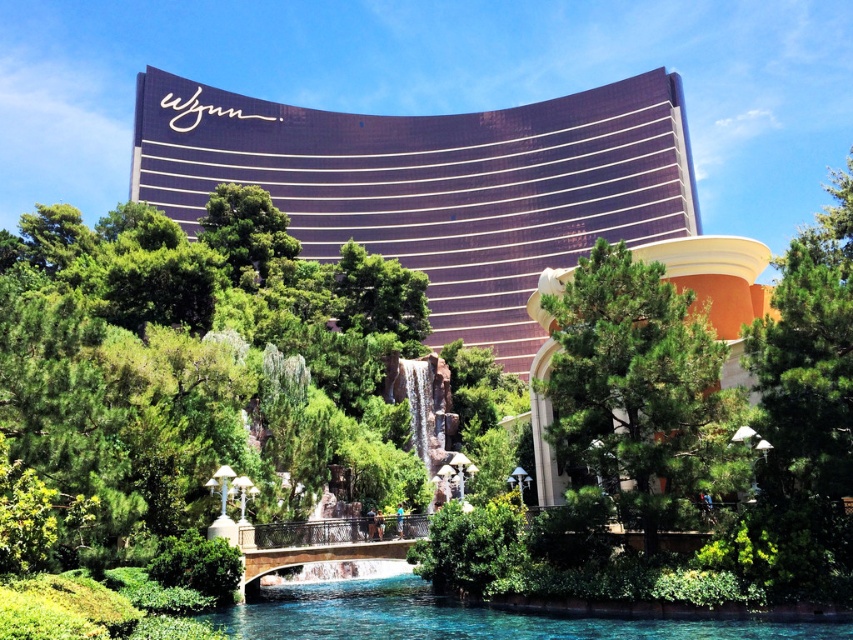
Is metallic gold hotel at upper center further to camera compared to clear blue water at lower center?

Yes, it is.

Who is more forward, (514, 262) or (413, 634)?

Point (413, 634)

This screenshot has width=853, height=640. What are the coordinates of `metallic gold hotel at upper center` in the screenshot? It's located at (436, 186).

Who is more distant from viewer, (598, 360) or (351, 621)?

The point (351, 621) is behind.

Who is positioned more to the right, green pine tree at center or clear blue water at lower center?

green pine tree at center is more to the right.

Locate an element on the screen. green pine tree at center is located at coordinates (637, 387).

Does metallic gold hotel at upper center have a larger size compared to green pine tree at center?

Correct, metallic gold hotel at upper center is larger in size than green pine tree at center.

Does metallic gold hotel at upper center come in front of green pine tree at center?

No, metallic gold hotel at upper center is further to the viewer.

Where is `metallic gold hotel at upper center`? metallic gold hotel at upper center is located at coordinates (436, 186).